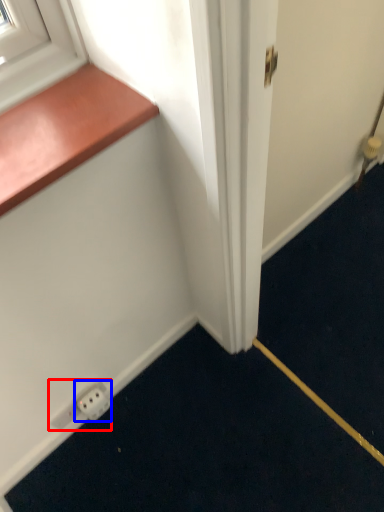
Question: Which of the following is the closest to the observer, electric outlet (highlighted by a red box) or electric outlet (highlighted by a blue box)?

Choices:
 (A) electric outlet
 (B) electric outlet

Answer: (B)